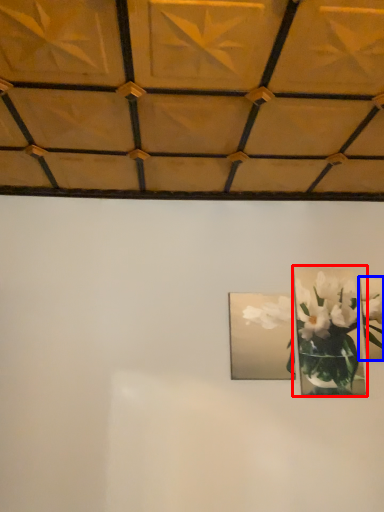
Question: Among these objects, which one is nearest to the camera, picture frame (highlighted by a red box) or picture frame (highlighted by a blue box)?

Choices:
 (A) picture frame
 (B) picture frame

Answer: (A)